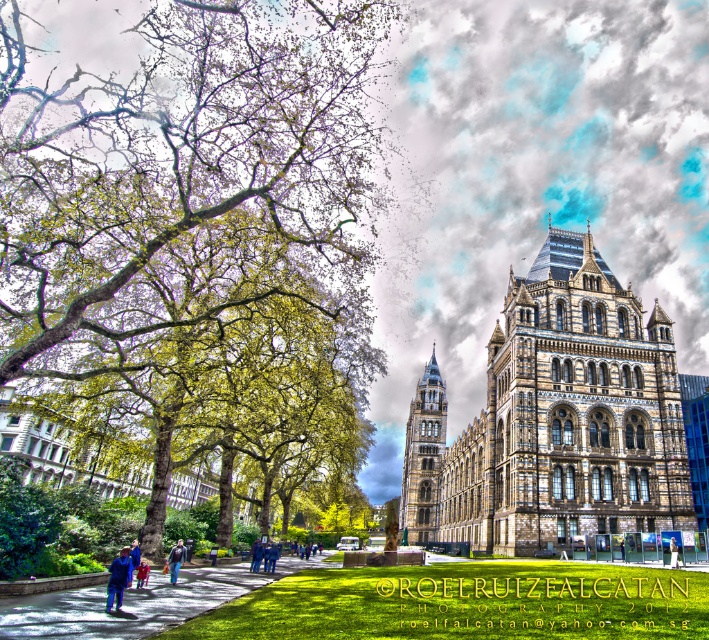
You are standing on the green asphalt path at lower center and looking towards the blue denim jeans at center. Which object is taller when viewed from your current position?

The green asphalt path at lower center is taller than the blue denim jeans at center according to the description.

You are standing at the point labeled as point (554, 419) in the image. What is the closest major structure to your current location?

The point (554, 419) indicates the brown stone church at center, so the closest major structure to your current location is the brown stone church at center.

You are a delivery person standing on the blue denim jeans at lower left and need to reach the green asphalt path at lower center. Can you step directly onto the path without needing to climb over anything?

The green asphalt path at lower center is taller than the blue denim jeans at lower left, so you can step onto the path without needing to climb over anything because it is elevated.